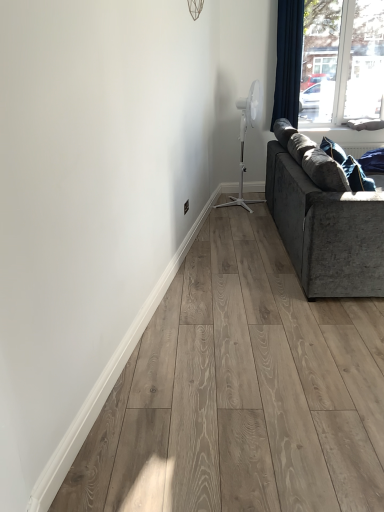
I want to click on white plastic fan at upper right, so click(x=244, y=139).

What do you see at coordinates (343, 63) in the screenshot? I see `transparent glass window at upper right` at bounding box center [343, 63].

The width and height of the screenshot is (384, 512). What do you see at coordinates (326, 230) in the screenshot?
I see `velvet grey couch at right` at bounding box center [326, 230].

The image size is (384, 512). Identify the location of white plastic fan at upper right. (244, 139).

Between denim pillow at lower right and dark blue fabric curtain at upper right, which one is positioned behind?

dark blue fabric curtain at upper right is behind.

From the picture: From the image's perspective, is denim pillow at lower right under dark blue fabric curtain at upper right?

Indeed, from the image's perspective, denim pillow at lower right is shown beneath dark blue fabric curtain at upper right.

Is denim pillow at lower right far from dark blue fabric curtain at upper right?

Yes.

From a real-world perspective, relative to velvet grey couch at right, is white plastic fan at upper right vertically above or below?

In terms of real-world spatial position, white plastic fan at upper right is above velvet grey couch at right.

Which object is closer to the camera, white plastic fan at upper right or velvet grey couch at right?

velvet grey couch at right is closer to the camera.

Find the location of `studio couch below the white plastic fan at upper right (from the image's perspective)`. studio couch below the white plastic fan at upper right (from the image's perspective) is located at coordinates (326, 230).

Is there a large distance between white plastic fan at upper right and velvet grey couch at right?

Yes, white plastic fan at upper right is far from velvet grey couch at right.

Would you consider white plastic fan at upper right to be distant from denim pillow at lower right?

Yes, white plastic fan at upper right and denim pillow at lower right are quite far apart.

Which of these two, white plastic fan at upper right or denim pillow at lower right, is thinner?

With smaller width is denim pillow at lower right.

From the image's perspective, which is above, white plastic fan at upper right or denim pillow at lower right?

white plastic fan at upper right is shown above in the image.

From the picture: Considering the sizes of objects white plastic fan at upper right and denim pillow at lower right in the image provided, who is taller, white plastic fan at upper right or denim pillow at lower right?

white plastic fan at upper right.

Is velvet grey couch at right outside of dark blue fabric curtain at upper right?

velvet grey couch at right is positioned outside dark blue fabric curtain at upper right.

From a real-world perspective, is velvet grey couch at right positioned under dark blue fabric curtain at upper right based on gravity?

Yes, from a real-world perspective, velvet grey couch at right is under dark blue fabric curtain at upper right.

How many degrees apart are the facing directions of velvet grey couch at right and dark blue fabric curtain at upper right?

88.8 degrees.

From the image's perspective, who appears lower, velvet grey couch at right or dark blue fabric curtain at upper right?

velvet grey couch at right, from the image's perspective.

Is transparent glass window at upper right taller than white plastic fan at upper right?

Correct, transparent glass window at upper right is much taller as white plastic fan at upper right.

Does transparent glass window at upper right have a smaller size compared to white plastic fan at upper right?

Indeed, transparent glass window at upper right has a smaller size compared to white plastic fan at upper right.

Is transparent glass window at upper right facing away from white plastic fan at upper right?

No, white plastic fan at upper right is not at the back of transparent glass window at upper right.

From the picture: Is transparent glass window at upper right behind white plastic fan at upper right?

Yes, the depth of transparent glass window at upper right is greater than that of white plastic fan at upper right.

From a real-world perspective, which is physically above, dark blue fabric curtain at upper right or velvet grey couch at right?

From a 3D spatial view, dark blue fabric curtain at upper right is above.

Is dark blue fabric curtain at upper right far from velvet grey couch at right?

dark blue fabric curtain at upper right is positioned a significant distance from velvet grey couch at right.

Considering the relative positions of dark blue fabric curtain at upper right and velvet grey couch at right in the image provided, is dark blue fabric curtain at upper right to the left of velvet grey couch at right from the viewer's perspective?

Yes, dark blue fabric curtain at upper right is to the left of velvet grey couch at right.

Which object is wider, dark blue fabric curtain at upper right or velvet grey couch at right?

Wider between the two is velvet grey couch at right.

From the picture: What's the angular difference between velvet grey couch at right and denim pillow at lower right's facing directions?

7.87 degrees.

Considering the sizes of objects velvet grey couch at right and denim pillow at lower right in the image provided, who is thinner, velvet grey couch at right or denim pillow at lower right?

denim pillow at lower right.

Relative to denim pillow at lower right, is velvet grey couch at right in front or behind?

Clearly, velvet grey couch at right is in front of denim pillow at lower right.

Where is `curtain that appears above the denim pillow at lower right (from a real-world perspective)`? The image size is (384, 512). curtain that appears above the denim pillow at lower right (from a real-world perspective) is located at coordinates (288, 61).

You are a GUI agent. You are given a task and a screenshot of the screen. Output one action in this format:
    pyautogui.click(x=<x>, y=<y>)
    Task: Click on the studio couch below the white plastic fan at upper right (from a real-world perspective)
    
    Given the screenshot: What is the action you would take?
    pyautogui.click(x=326, y=230)

From the image, which object appears to be farther from denim pillow at lower right, transparent glass window at upper right or white plastic fan at upper right?

transparent glass window at upper right is further to denim pillow at lower right.

Consider the image. When comparing their distances from denim pillow at lower right, does white plastic fan at upper right or dark blue fabric curtain at upper right seem closer?

dark blue fabric curtain at upper right is positioned closer to the anchor denim pillow at lower right.

Considering their positions, is velvet grey couch at right positioned closer to transparent glass window at upper right than white plastic fan at upper right?

The object closer to transparent glass window at upper right is white plastic fan at upper right.

Considering their positions, is velvet grey couch at right positioned further to white plastic fan at upper right than dark blue fabric curtain at upper right?

velvet grey couch at right lies further to white plastic fan at upper right than the other object.

Based on their spatial positions, is denim pillow at lower right or transparent glass window at upper right further from dark blue fabric curtain at upper right?

The object further to dark blue fabric curtain at upper right is denim pillow at lower right.

Looking at this image, considering their positions, is dark blue fabric curtain at upper right positioned closer to denim pillow at lower right than velvet grey couch at right?

Based on the image, velvet grey couch at right appears to be nearer to denim pillow at lower right.

Looking at this image, which object lies further to the anchor point transparent glass window at upper right, white plastic fan at upper right or velvet grey couch at right?

velvet grey couch at right is further to transparent glass window at upper right.

Looking at the image, which one is located closer to transparent glass window at upper right, dark blue fabric curtain at upper right or velvet grey couch at right?

dark blue fabric curtain at upper right.

Locate an element on the screen. The image size is (384, 512). fan between dark blue fabric curtain at upper right and denim pillow at lower right in the vertical direction is located at coordinates (244, 139).

Locate an element on the screen. This screenshot has width=384, height=512. curtain between white plastic fan at upper right and transparent glass window at upper right is located at coordinates (288, 61).

I want to click on curtain between velvet grey couch at right and transparent glass window at upper right from front to back, so click(288, 61).

Image resolution: width=384 pixels, height=512 pixels. Identify the location of fan between velvet grey couch at right and transparent glass window at upper right from front to back. (244, 139).